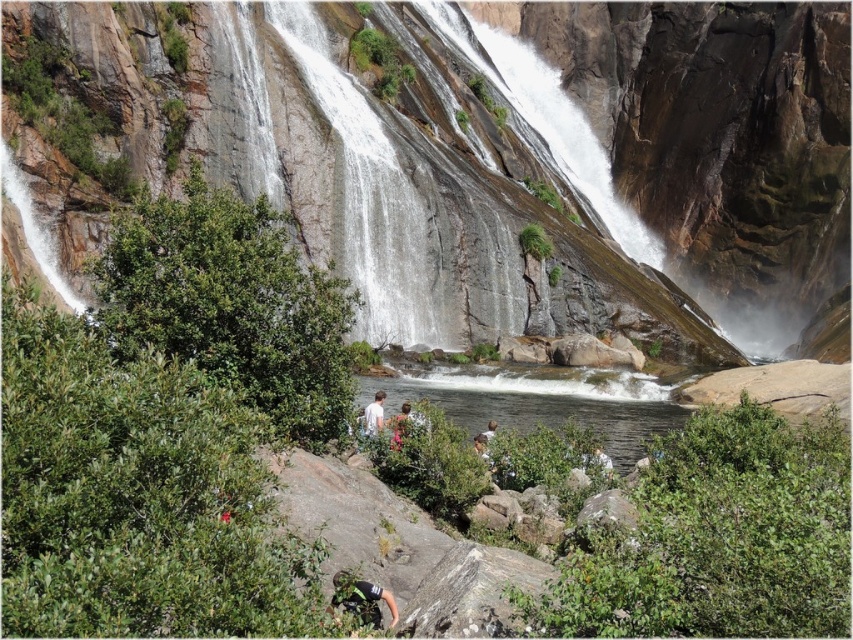
You are a photographer planning to capture the waterfall scene. You want to ensure both the gray rough rock at center and the white matte shirt at center are clearly visible in your shot. Considering their sizes, which object should you focus on first to ensure proper framing?

The gray rough rock at center is smaller than the white matte shirt at center, so you should focus on the white matte shirt at center first to ensure it is properly framed, as it is larger and might require more attention in the composition.

You are planning to hike near the waterfall and want to know the location of the green climbing harness at lower center relative to the clear water at center. Which object is positioned to the left?

The green climbing harness at lower center is positioned to the left of the clear water at center.